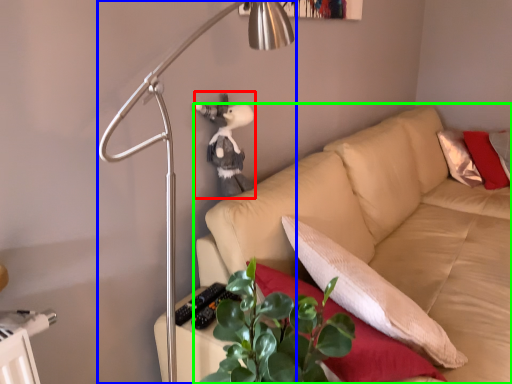
Question: Which is nearer to the figurine (highlighted by a red box)? lamp (highlighted by a blue box) or studio couch (highlighted by a green box).

Choices:
 (A) lamp
 (B) studio couch

Answer: (A)